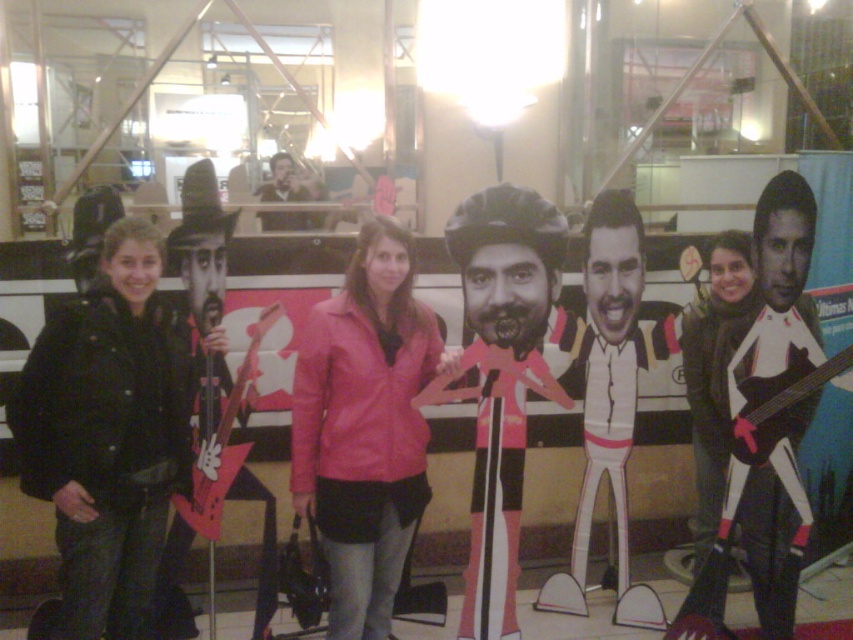
You are standing at the origin point in the image. Which of the two points, point [532,292] or point [766,387], is closer to you?

Point [532,292] is closer to you because it is in front of point [766,387].

You are a photographer setting up for a group photo. You have a white matte guitar at right and a white cardboard figure at center. Which object is taller when viewed from your position?

The white cardboard figure at center is taller than the white matte guitar at right.

You are standing in the shopping mall and see two points marked in the image. Which point, point [354,486] or point [727,417], is closer to you?

Point [354,486] is closer to the viewer than point [727,417].